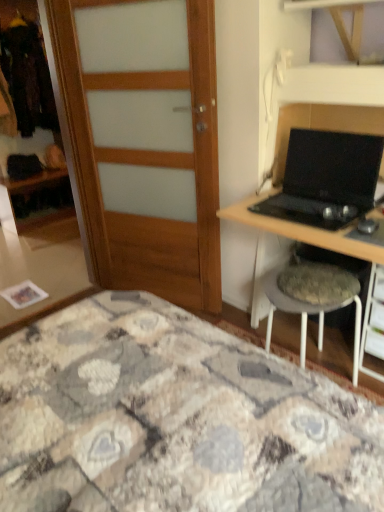
Question: From the image's perspective, relative to matte wood wardrobe at left, is black plastic mouse at right above or below?

Choices:
 (A) below
 (B) above

Answer: (A)

Question: Considering the positions of black plastic mouse at right and matte wood wardrobe at left in the image, is black plastic mouse at right bigger or smaller than matte wood wardrobe at left?

Choices:
 (A) big
 (B) small

Answer: (B)

Question: Which object is the closest to the black plastic mouse at right?

Choices:
 (A) black matte laptop at right
 (B) matte wood wardrobe at left
 (C) wooden door at left
 (D) black plastic drawer at lower right
 (E) textured fabric stool at right

Answer: (A)

Question: Which object is the farthest from the wooden door at left?

Choices:
 (A) black plastic drawer at lower right
 (B) matte wood wardrobe at left
 (C) black matte laptop at right
 (D) textured fabric stool at right
 (E) black plastic mouse at right

Answer: (B)